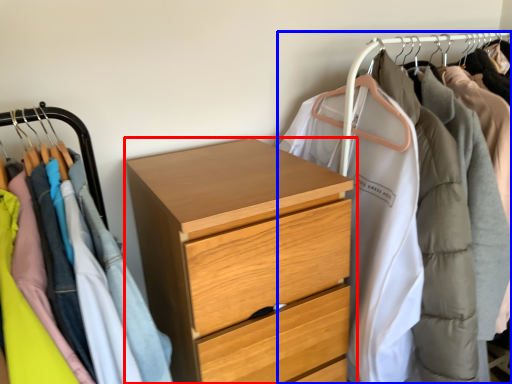
Question: Which object appears closest to the camera in this image, chest of drawers (highlighted by a red box) or closet (highlighted by a blue box)?

Choices:
 (A) chest of drawers
 (B) closet

Answer: (B)